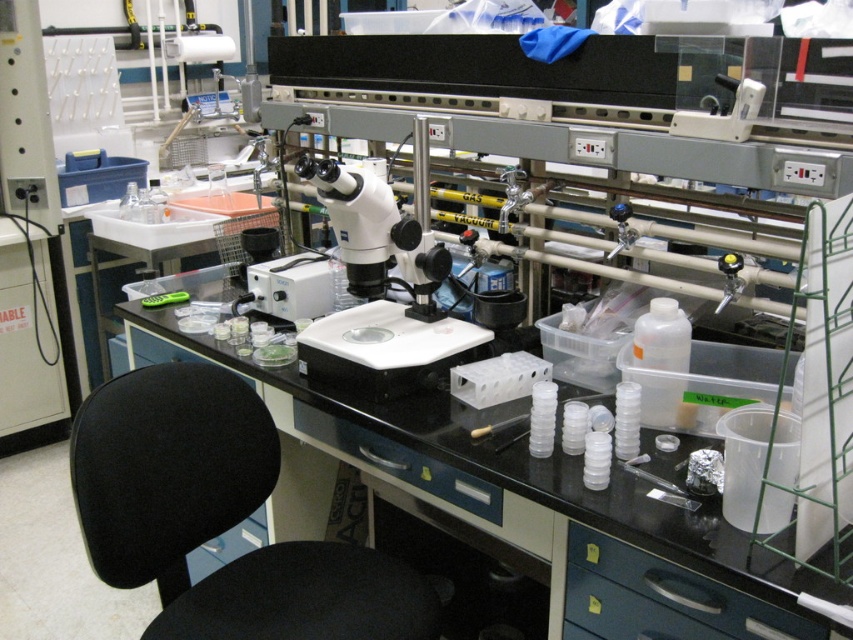
Question: Which object is positioned farthest from the black fabric stool at lower left?

Choices:
 (A) black plastic drawer at lower right
 (B) white plastic microscope at center

Answer: (B)

Question: Does white plastic microscope at center have a larger size compared to black plastic drawer at lower right?

Choices:
 (A) yes
 (B) no

Answer: (A)

Question: Can you confirm if black fabric stool at lower left is wider than black plastic drawer at lower right?

Choices:
 (A) yes
 (B) no

Answer: (A)

Question: Estimate the real-world distances between objects in this image. Which object is farther from the black fabric stool at lower left?

Choices:
 (A) black plastic drawer at lower right
 (B) white plastic microscope at center

Answer: (B)

Question: Based on their relative distances, which object is farther from the black fabric stool at lower left?

Choices:
 (A) black plastic drawer at lower right
 (B) white plastic microscope at center

Answer: (B)

Question: Does white plastic microscope at center have a smaller size compared to black fabric stool at lower left?

Choices:
 (A) yes
 (B) no

Answer: (B)